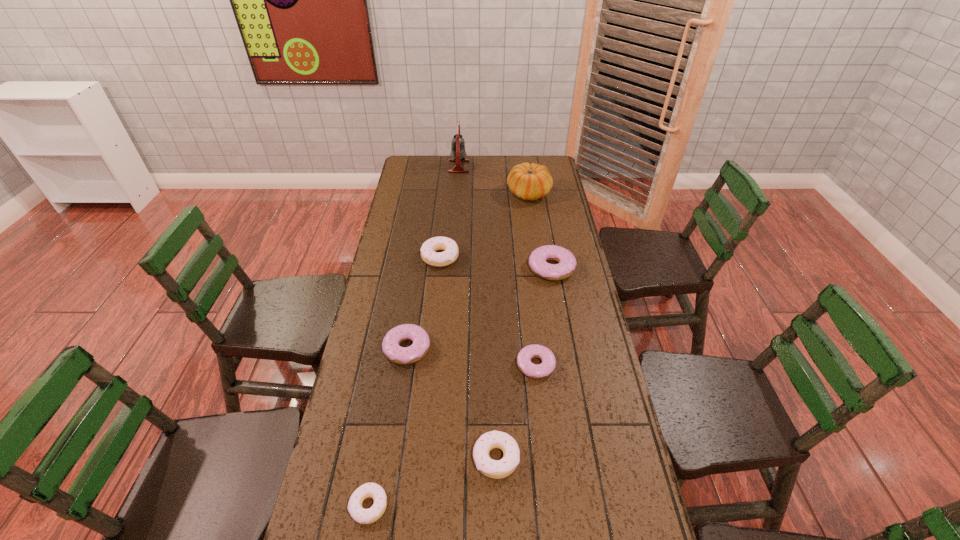
Find the location of a particular element. The image size is (960, 540). object that is at the far edge is located at coordinates (458, 153).

I want to click on gourd at the right edge, so click(529, 182).

Find the location of `vacant region at the far edge of the desktop`. vacant region at the far edge of the desktop is located at coordinates (486, 170).

The width and height of the screenshot is (960, 540). I want to click on free space at the left edge of the desktop, so (x=418, y=210).

In the image, there is a desktop. Where is `vacant space at the right edge`? The height and width of the screenshot is (540, 960). vacant space at the right edge is located at coordinates (588, 332).

In the image, there is a desktop. Identify the location of free space at the far left corner. This screenshot has height=540, width=960. (409, 172).

Where is `vacant space at the far right corner of the desktop`? Image resolution: width=960 pixels, height=540 pixels. vacant space at the far right corner of the desktop is located at coordinates (551, 164).

This screenshot has width=960, height=540. Find the location of `empty space that is in between the seventh shortest object and the fourth object from right to left`. empty space that is in between the seventh shortest object and the fourth object from right to left is located at coordinates (513, 326).

The height and width of the screenshot is (540, 960). Identify the location of empty space that is in between the biggest white doughnut and the bell. (449, 212).

Identify the location of blank region between the farthest white doughnut and the bell. The height and width of the screenshot is (540, 960). (449, 212).